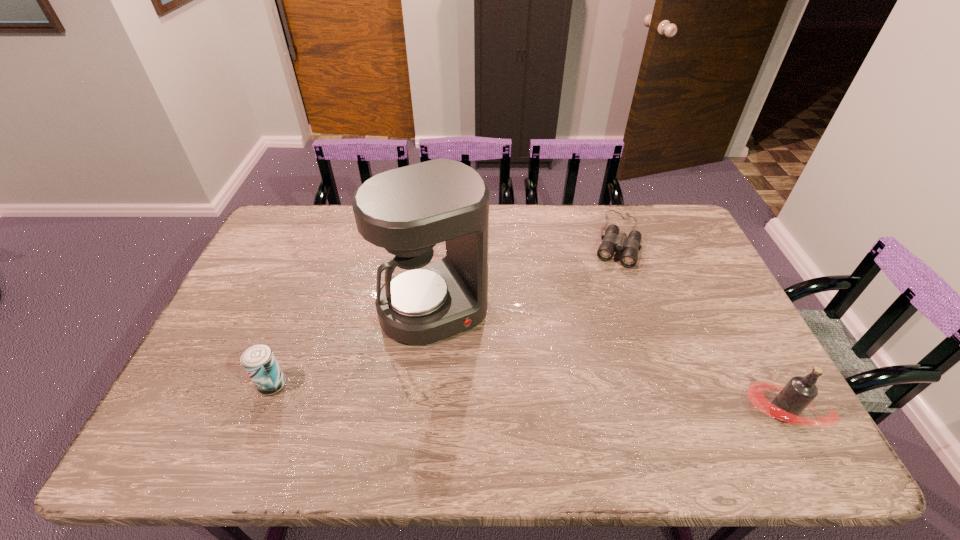
This screenshot has height=540, width=960. Identify the location of vacant space positioned at the eyepiece of the binoculars. (591, 347).

You are a GUI agent. You are given a task and a screenshot of the screen. Output one action in this format:
    pyautogui.click(x=<x>, y=<y>)
    Task: Click on the free region located 0.330m at the eyepiece of the binoculars
    This screenshot has width=960, height=540.
    Given the screenshot: What is the action you would take?
    pyautogui.click(x=593, y=342)

Identify the location of vacant space situated on the front-facing side of the third nearest object. (492, 404).

Where is `free space located 0.160m on the front-facing side of the third nearest object`? free space located 0.160m on the front-facing side of the third nearest object is located at coordinates (482, 388).

Locate an element on the screen. The image size is (960, 540). free space located 0.130m on the front-facing side of the third nearest object is located at coordinates (477, 379).

The height and width of the screenshot is (540, 960). Find the location of `object that is at the far edge`. object that is at the far edge is located at coordinates (611, 241).

The image size is (960, 540). Identify the location of beer can present at the near edge. (258, 360).

The height and width of the screenshot is (540, 960). What are the coordinates of `root beer located in the near edge section of the desktop` in the screenshot? It's located at (799, 392).

Where is `object that is positioned at the right edge`? The image size is (960, 540). object that is positioned at the right edge is located at coordinates (799, 392).

The image size is (960, 540). What are the coordinates of `object that is at the near right corner` in the screenshot? It's located at (799, 392).